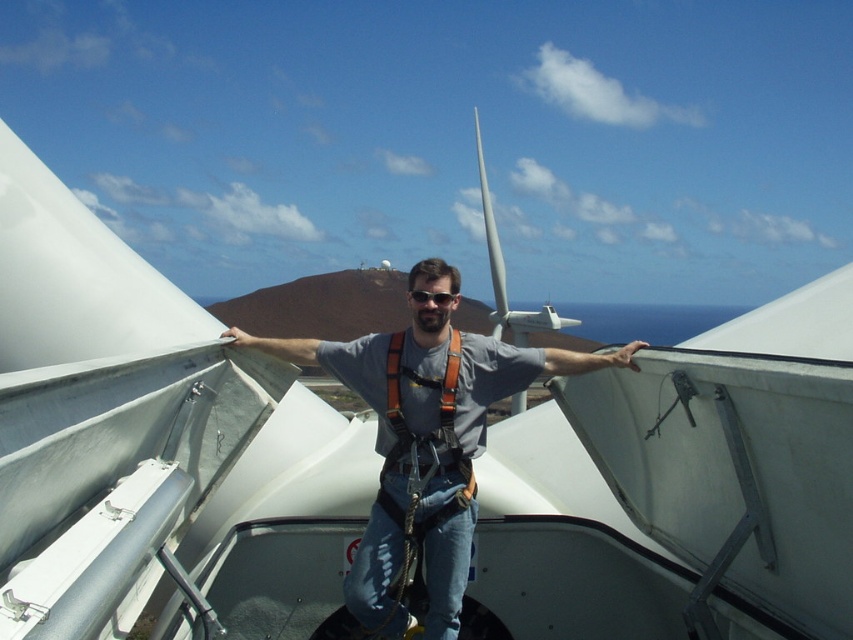
You are a safety inspector reviewing the image of a worker on a wind turbine. You notice the orange fabric safety vest at center and the black plastic goggles at center. Which piece of safety equipment is positioned closer to the worker?

The orange fabric safety vest at center is closer to the viewer than the black plastic goggles at center, so the safety vest is positioned closer to the worker.

You are a safety inspector reviewing the image of a worker on a wind turbine. You notice the gray fabric construction worker at center and the orange fabric safety vest at center. Which object appears smaller in the image?

The gray fabric construction worker at center appears smaller compared to the orange fabric safety vest at center.

Based on the photo, you are a safety inspector reviewing the image of a worker on a wind turbine. The worker is wearing an orange fabric safety vest at center and black plastic goggles at center. Based on the image, which item is wider?

The orange fabric safety vest at center might be wider than black plastic goggles at center.